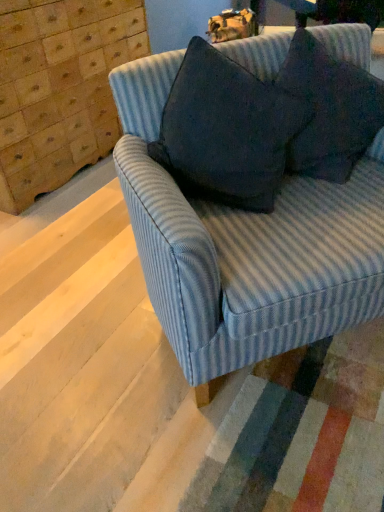
Find the location of a particular element. This screenshot has width=384, height=512. vacant position to the left of blue striped fabric couch at center is located at coordinates (74, 313).